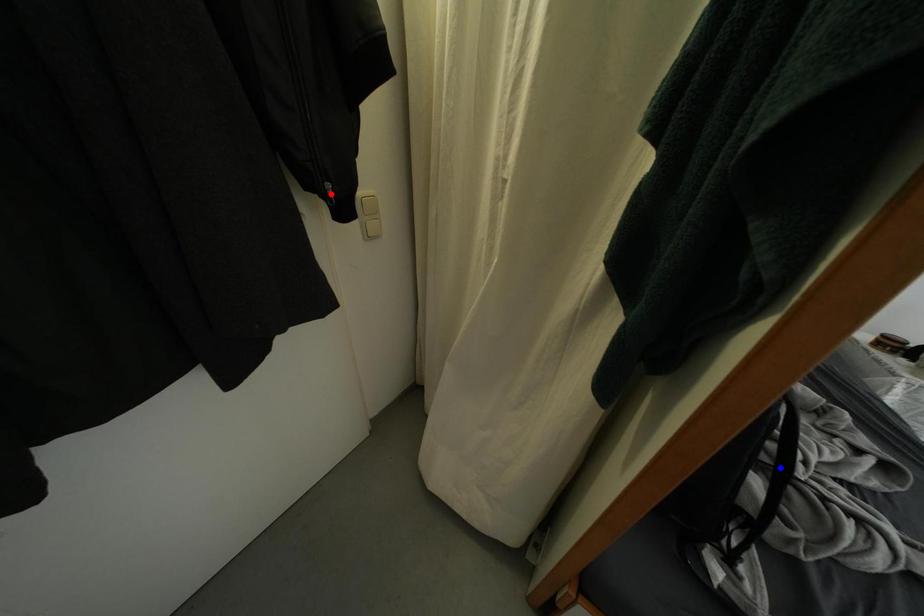
Question: Which of the two points in the image is closer to the camera?

Choices:
 (A) Blue point is closer.
 (B) Red point is closer.

Answer: (B)